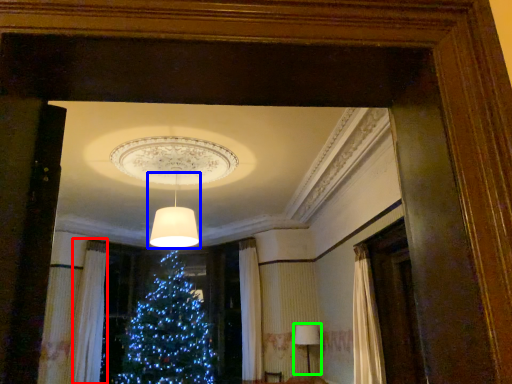
Question: Based on their relative distances, which object is farther from curtain (highlighted by a red box)? Choose from lamp (highlighted by a blue box) and lamp (highlighted by a green box).

Choices:
 (A) lamp
 (B) lamp

Answer: (B)